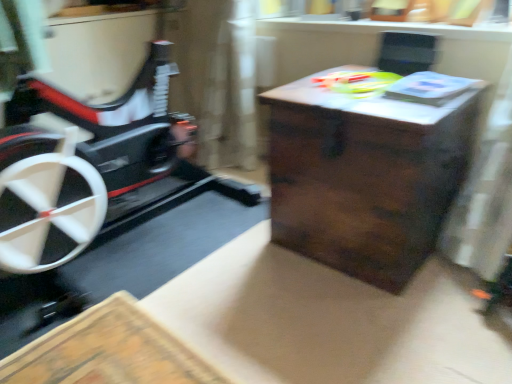
Question: Is translucent plastic toy at upper center positioned beyond the bounds of dark wood table at center?

Choices:
 (A) no
 (B) yes

Answer: (B)

Question: Is translucent plastic toy at upper center closer to camera compared to dark wood table at center?

Choices:
 (A) no
 (B) yes

Answer: (A)

Question: Is translucent plastic toy at upper center smaller than dark wood table at center?

Choices:
 (A) no
 (B) yes

Answer: (B)

Question: Is translucent plastic toy at upper center oriented away from dark wood table at center?

Choices:
 (A) no
 (B) yes

Answer: (A)

Question: From the image's perspective, is translucent plastic toy at upper center over dark wood table at center?

Choices:
 (A) yes
 (B) no

Answer: (A)

Question: From a real-world perspective, is translucent plastic toy at upper center below dark wood table at center?

Choices:
 (A) yes
 (B) no

Answer: (B)

Question: From a real-world perspective, is dark wood table at center positioned over translucent plastic toy at upper center based on gravity?

Choices:
 (A) no
 (B) yes

Answer: (A)

Question: Can translucent plastic toy at upper center be found inside dark wood table at center?

Choices:
 (A) yes
 (B) no

Answer: (B)

Question: Is dark wood table at center positioned far away from translucent plastic toy at upper center?

Choices:
 (A) yes
 (B) no

Answer: (B)

Question: Considering the relative sizes of dark wood table at center and translucent plastic toy at upper center in the image provided, is dark wood table at center taller than translucent plastic toy at upper center?

Choices:
 (A) no
 (B) yes

Answer: (B)

Question: Is dark wood table at center closer to the viewer compared to translucent plastic toy at upper center?

Choices:
 (A) yes
 (B) no

Answer: (A)

Question: Is dark wood table at center turned away from translucent plastic toy at upper center?

Choices:
 (A) no
 (B) yes

Answer: (A)

Question: Is point (347, 82) positioned closer to the camera than point (411, 145)?

Choices:
 (A) closer
 (B) farther

Answer: (B)